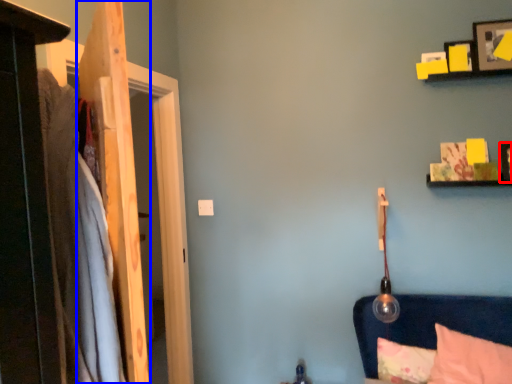
Question: Which object is further to the camera taking this photo, picture frame (highlighted by a red box) or door (highlighted by a blue box)?

Choices:
 (A) picture frame
 (B) door

Answer: (A)